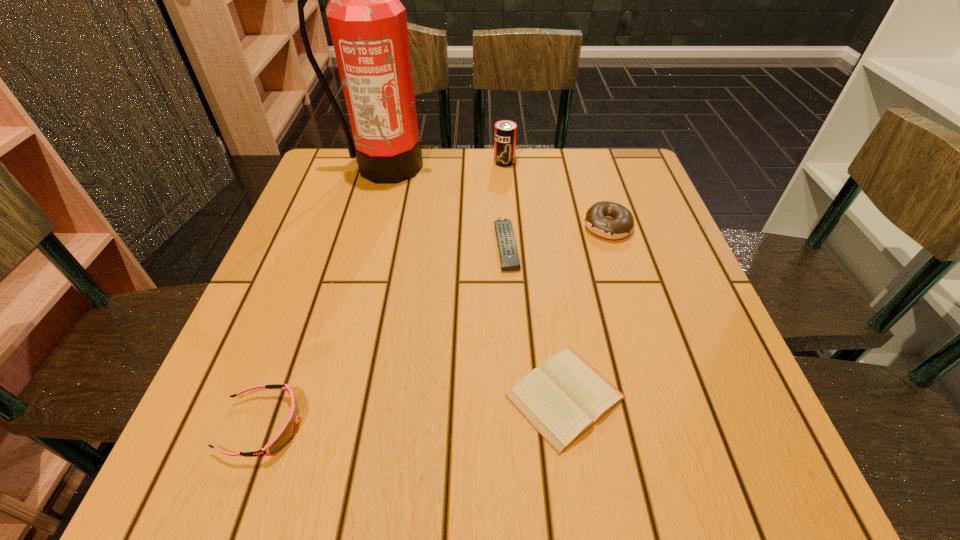
Locate an element on the screen. The image size is (960, 540). fire extinguisher is located at coordinates (368, 25).

Where is `the fifth shortest object`? The height and width of the screenshot is (540, 960). the fifth shortest object is located at coordinates (505, 131).

You are a GUI agent. You are given a task and a screenshot of the screen. Output one action in this format:
    pyautogui.click(x=<x>, y=<y>)
    Task: Click on the doughnut
    The width and height of the screenshot is (960, 540).
    Given the screenshot: What is the action you would take?
    pyautogui.click(x=610, y=220)

Find the location of a particular element. goggles is located at coordinates (287, 432).

In order to click on diary in this screenshot , I will do `click(563, 399)`.

Where is `remote control`? remote control is located at coordinates [x=508, y=252].

The image size is (960, 540). What are the coordinates of `vacant space situated on the front side of the fire extinguisher` in the screenshot? It's located at (357, 264).

Locate an element on the screen. The image size is (960, 540). vacant area situated 0.330m on the front of the can is located at coordinates (511, 252).

Where is `free spot located on the back of the rightmost object`? The height and width of the screenshot is (540, 960). free spot located on the back of the rightmost object is located at coordinates (585, 151).

I want to click on free region located on the front-facing side of the goggles, so click(x=420, y=425).